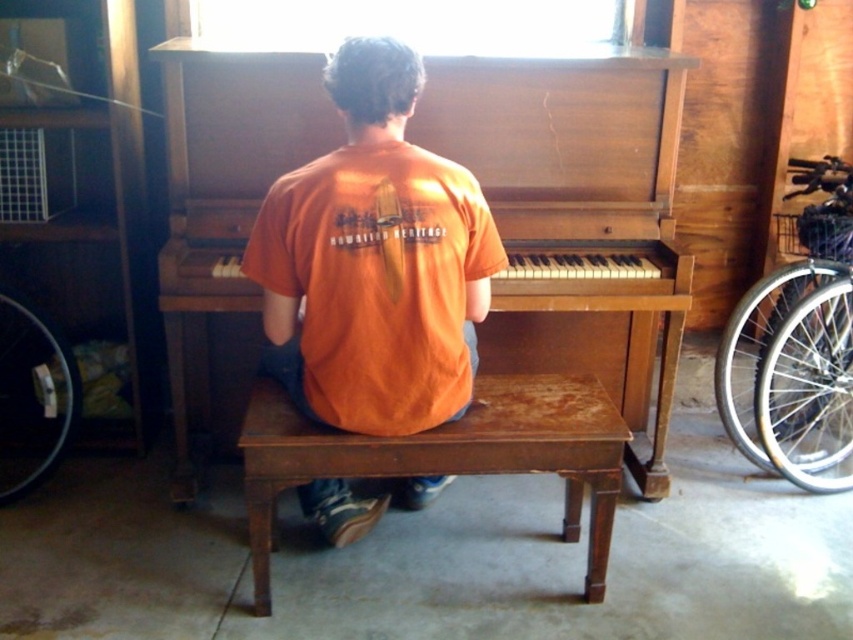
You are trying to decide where to place a new plant in the garage. The wooden piano at center and the dark brown wooden stool at center are both in the way. Which object should you move to make more space?

You should move the wooden piano at center because it is larger in size than the dark brown wooden stool at center, so moving it would create more space.

You are a photographer setting up a shoot in the garage. You want to place a light to the right of the wooden piano at center and behind the dark brown wooden stool at center. Is this possible given their positions?

The wooden piano at center is positioned on the left side of dark brown wooden stool at center. Therefore, placing a light to the right of the wooden piano at center and behind the dark brown wooden stool at center is not possible because the stool is already to the right of the piano.

You are a photographer standing in the garage and want to take a photo of the wooden piano at center and orange matte shirt at center. The minimum distance required between the camera and the subject for clear focus is 60 centimeters. Can you take a clear photo of both subjects without moving them?

The wooden piano at center is 61.50 centimeters from orange matte shirt at center. Since the minimum focus distance is 60 centimeters, the camera can be positioned at a distance where both subjects are within the focus range, as the distance between them is sufficient. Therefore, yes, you can take a clear photo of both subjects without moving them.